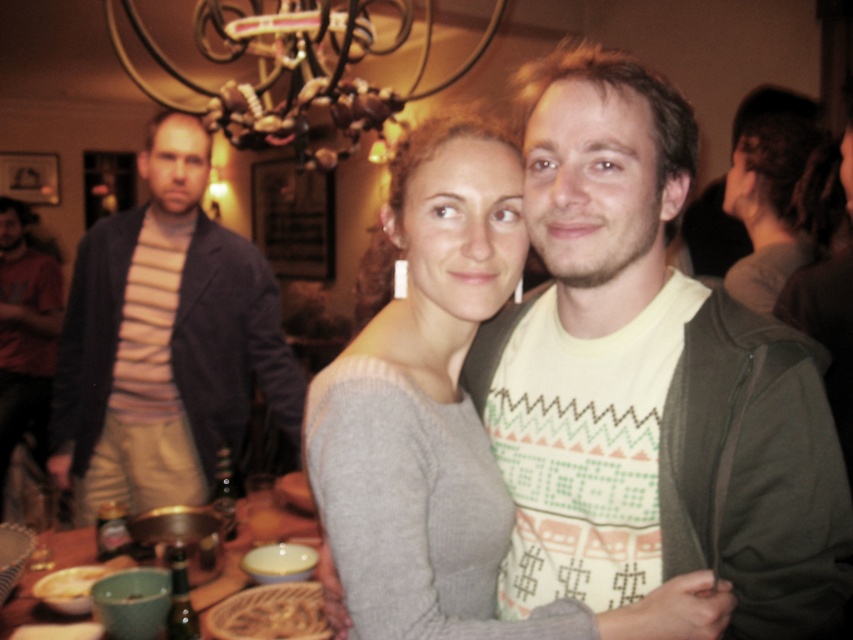
You are a photographer trying to capture a photo of the knit sweater at center and the wooden table at lower left. If your camera can only focus on objects within 30 inches of each other, will both items be in focus?

The knit sweater at center and wooden table at lower left are 35.85 inches apart, which exceeds the 30 inches focus range. Therefore, both items cannot be in focus simultaneously.

You are organizing a small party and need to place a decorative item on a shelf that can only hold items up to 10 inches wide. You have the knit sweater at center and the smooth brown rice at center. Which item should you choose to fit on the shelf?

The smooth brown rice at center should be chosen because the knit sweater at center is wider than it, ensuring the rice fits within the 10 inch limit.